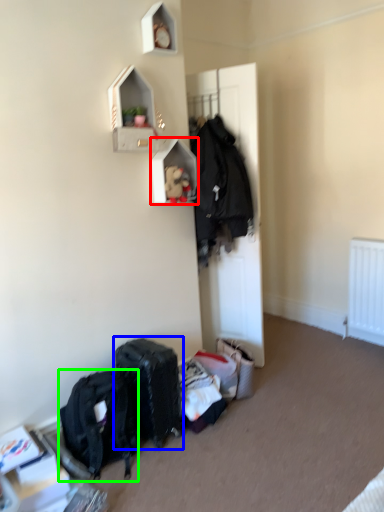
Question: Which object is the farthest from shelf (highlighted by a red box)? Choose among these: luggage and bags (highlighted by a blue box) or backpack (highlighted by a green box).

Choices:
 (A) luggage and bags
 (B) backpack

Answer: (B)